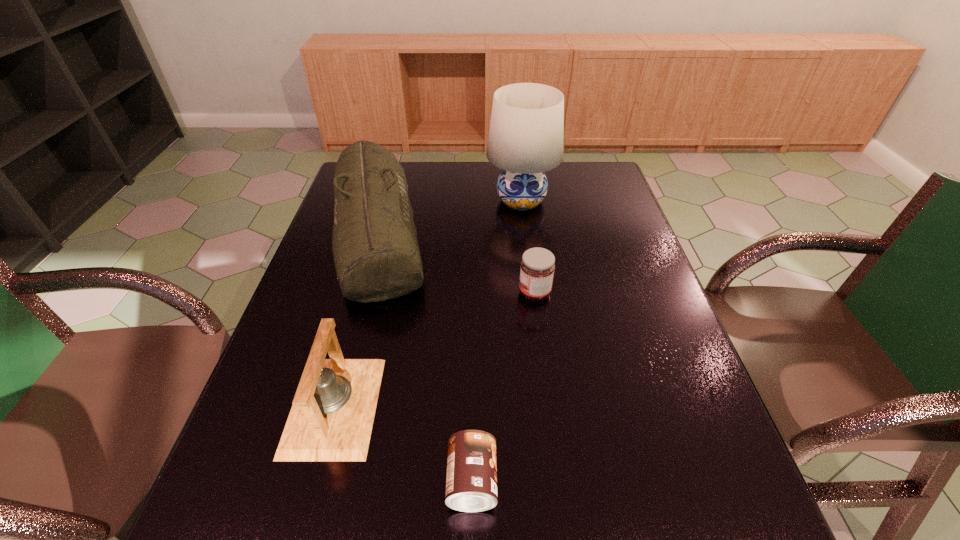
The height and width of the screenshot is (540, 960). Identify the location of object that is the second closest to the lampshade. (537, 266).

Point out which object is positioned as the nearest to the duffel bag. Please provide its 2D coordinates. Your answer should be formatted as a tuple, i.e. [(x, y)], where the tuple contains the x and y coordinates of a point satisfying the conditions above.

[(331, 419)]

Image resolution: width=960 pixels, height=540 pixels. Identify the location of vacant area that satisfies the following two spatial constraints: 1. on the front side of the bell; 2. on the right side of the duffel bag. (329, 406).

Identify the location of vacant point that satisfies the following two spatial constraints: 1. on the front-facing side of the tallest object; 2. on the front label of the shortest object. (556, 481).

Find the location of a particular element. free space in the image that satisfies the following two spatial constraints: 1. on the back side of the third tallest object; 2. on the left side of the jam is located at coordinates (365, 293).